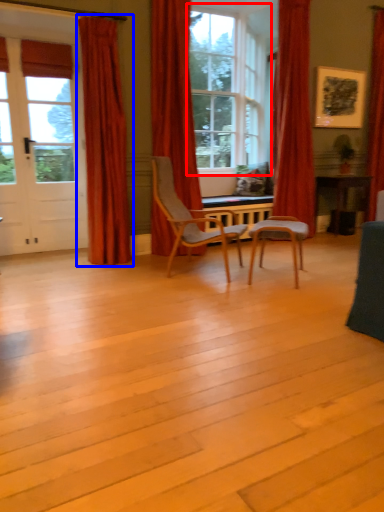
Question: Which object appears closest to the camera in this image, window (highlighted by a red box) or curtain (highlighted by a blue box)?

Choices:
 (A) window
 (B) curtain

Answer: (B)